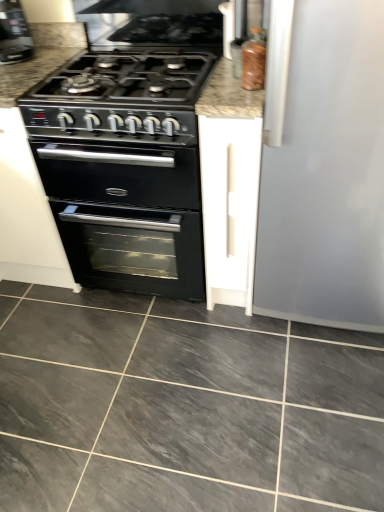
The image size is (384, 512). Find the location of `vacant space situated on the left part of translucent amber bottle at upper right`. vacant space situated on the left part of translucent amber bottle at upper right is located at coordinates (222, 93).